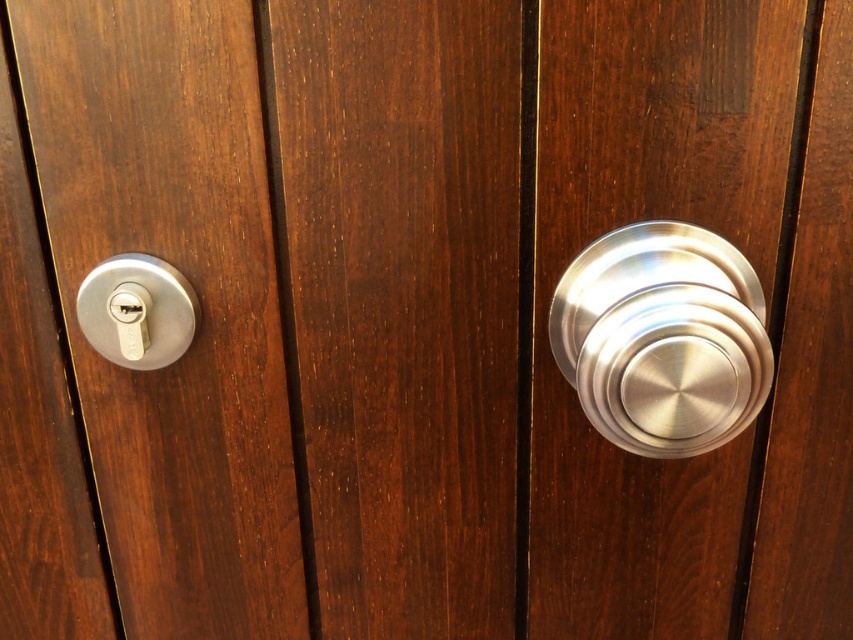
Question: Among these points, which one is farthest from the camera?

Choices:
 (A) (549, 323)
 (B) (315, 636)
 (C) (537, 412)

Answer: (B)

Question: Does dark wood door at center have a larger size compared to satin silver door handle at right?

Choices:
 (A) no
 (B) yes

Answer: (B)

Question: Can you confirm if satin silver door handle at right is positioned above matte silver lock at left?

Choices:
 (A) no
 (B) yes

Answer: (A)

Question: In this image, where is satin nickel lock at left located relative to satin silver door handle at right?

Choices:
 (A) left
 (B) right

Answer: (A)

Question: Which object is closer to the camera taking this photo?

Choices:
 (A) satin nickel lock at left
 (B) dark wood door at center
 (C) satin nickel doorknob at right

Answer: (C)

Question: Which point is closer to the camera?

Choices:
 (A) satin silver door handle at right
 (B) matte silver lock at left
 (C) satin nickel doorknob at right
 (D) satin nickel lock at left

Answer: (A)